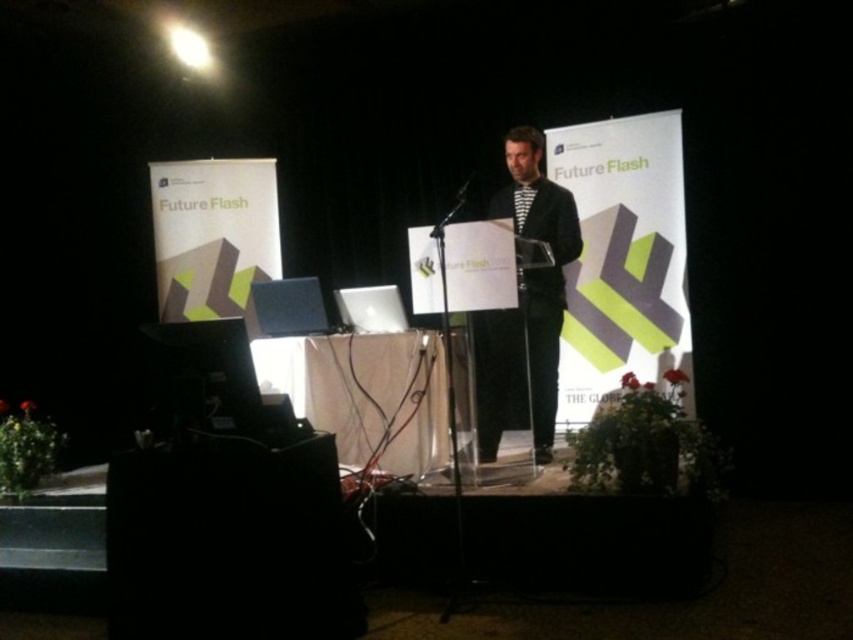
Between striped fabric shirt at center and transparent plastic microphone at center, which one appears on the left side from the viewer's perspective?

Positioned to the left is transparent plastic microphone at center.

Is the position of striped fabric shirt at center less distant than that of transparent plastic microphone at center?

Yes, striped fabric shirt at center is closer to the viewer.

Is point (544, 369) closer to camera compared to point (456, 196)?

Yes.

Identify the location of striped fabric shirt at center. The image size is (853, 640). (525, 300).

Who is taller, black plastic speaker at lower left or transparent plastic microphone at center?

With more height is black plastic speaker at lower left.

Can you confirm if black plastic speaker at lower left is smaller than transparent plastic microphone at center?

Incorrect, black plastic speaker at lower left is not smaller in size than transparent plastic microphone at center.

Which is in front, point (245, 484) or point (460, 195)?

Positioned in front is point (245, 484).

Where is `black plastic speaker at lower left`? The image size is (853, 640). black plastic speaker at lower left is located at coordinates (x=229, y=541).

Describe the element at coordinates (229, 541) in the screenshot. I see `black plastic speaker at lower left` at that location.

Is black plastic speaker at lower left positioned at the back of striped fabric shirt at center?

That is False.

In order to click on black plastic speaker at lower left in this screenshot , I will do `click(229, 541)`.